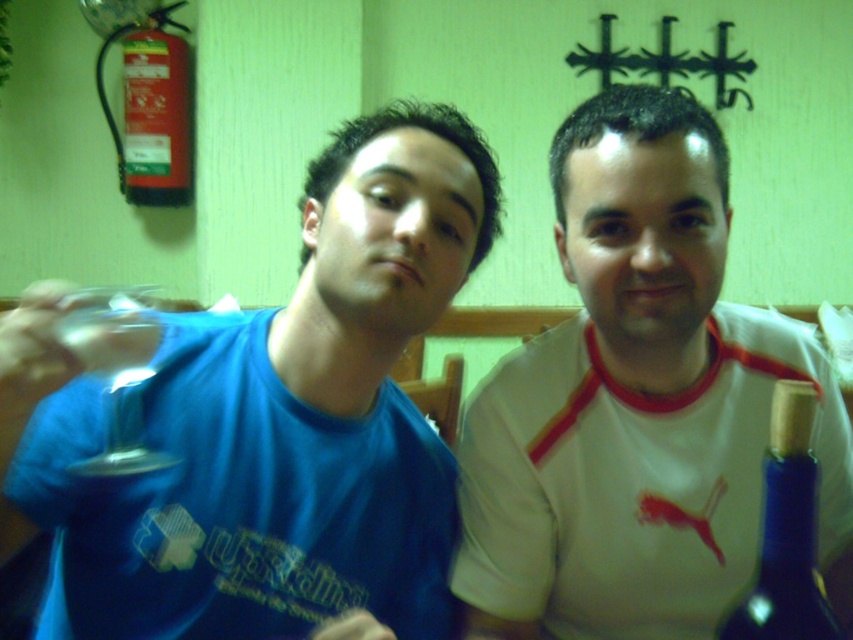
Which of these two, matte blue t-shirt at center or transparent glass at left, stands taller?

matte blue t-shirt at center

Which is behind, point (22, 477) or point (97, 317)?

Positioned behind is point (22, 477).

Locate an element on the screen. The image size is (853, 640). matte blue t-shirt at center is located at coordinates pyautogui.click(x=267, y=422).

Between white matte shirt at center and blue glass bottle at right, which one is positioned lower?

blue glass bottle at right is lower down.

Can you confirm if white matte shirt at center is taller than blue glass bottle at right?

Indeed, white matte shirt at center has a greater height compared to blue glass bottle at right.

Does point (610, 406) lie in front of point (791, 532)?

No, (610, 406) is behind (791, 532).

Locate an element on the screen. The width and height of the screenshot is (853, 640). white matte shirt at center is located at coordinates (637, 404).

Between white matte shirt at center and transparent glass at left, which one has more height?

With more height is white matte shirt at center.

Does white matte shirt at center come in front of transparent glass at left?

No, it is behind transparent glass at left.

What do you see at coordinates (637, 404) in the screenshot?
I see `white matte shirt at center` at bounding box center [637, 404].

The height and width of the screenshot is (640, 853). Identify the location of white matte shirt at center. (637, 404).